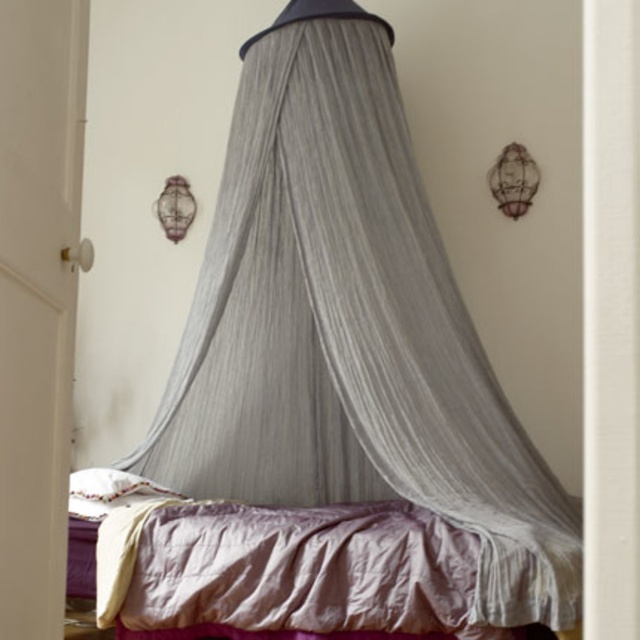
Between gray fabric canopy at upper center and silky purple bed at center, which one has less height?

With less height is silky purple bed at center.

Is point (412, 292) behind point (317, 605)?

Yes, it is behind point (317, 605).

Who is more distant from viewer, (320, 440) or (396, 628)?

The point (320, 440) is more distant.

Locate an element on the screen. The height and width of the screenshot is (640, 640). gray fabric canopy at upper center is located at coordinates click(x=349, y=328).